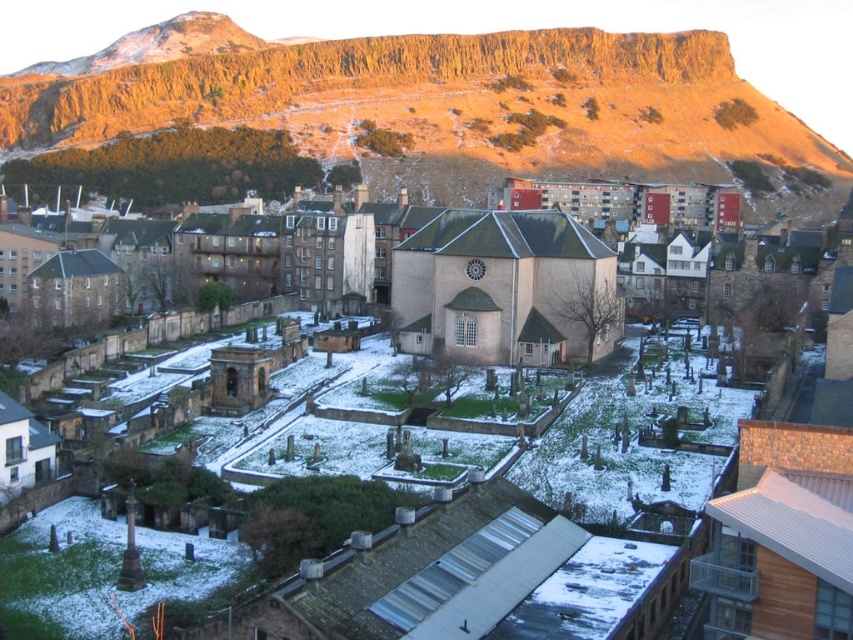
You are standing at the entrance of the cemetery and want to take a photo of both the golden rock formation at upper center and the smooth stone church at center. Which object should you focus on first to ensure both are in the frame?

You should focus on the smooth stone church at center first because it is closer to you than the golden rock formation at upper center, which is further away. This way, both will be in the frame when properly adjusted.

You are standing at the entrance of the cemetery and want to take a photo of both the golden rock formation at upper center and the white stone church at center. Given their sizes, which one will appear larger in the photo?

The golden rock formation at upper center will appear larger in the photo because it is much taller than the white stone church at center.